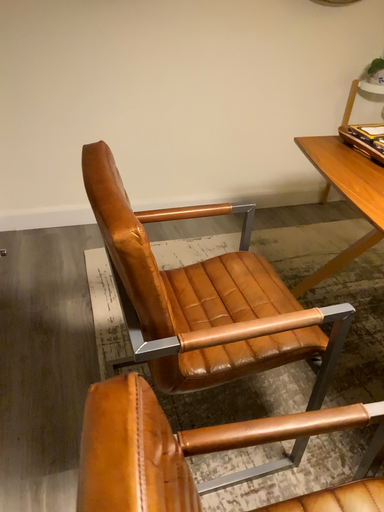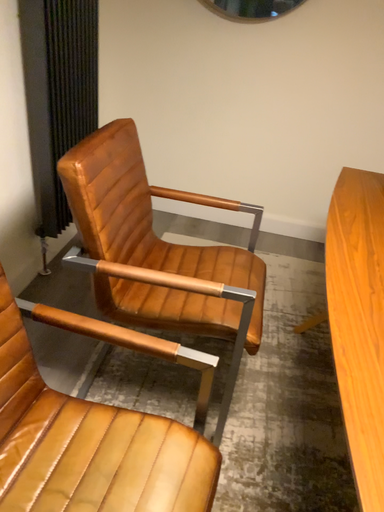
Question: How did the camera likely rotate when shooting the video?

Choices:
 (A) rotated right
 (B) rotated left

Answer: (B)